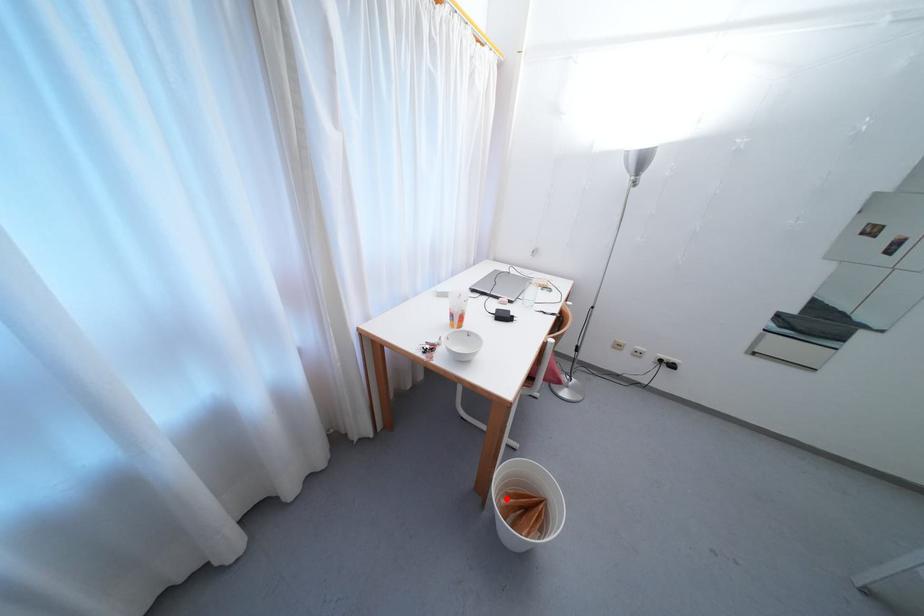
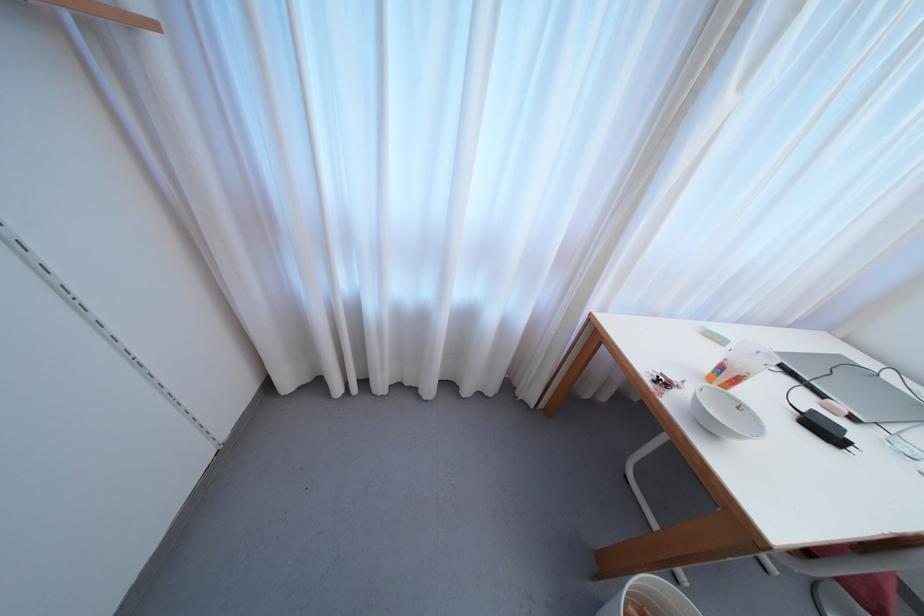
In the second image, find the point that corresponds to the highlighted location in the first image.

(638, 607)